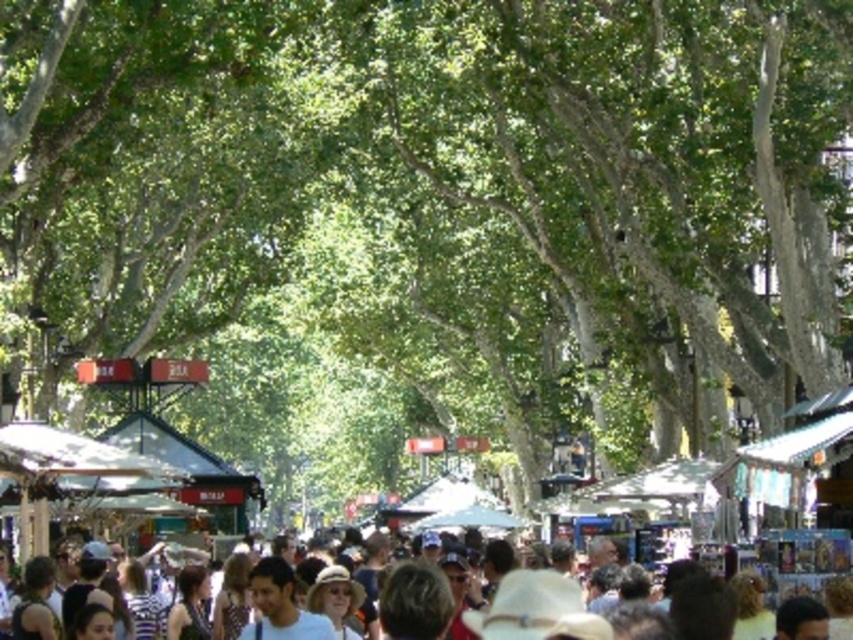
Does multicolored fabric crowd at center have a larger size compared to light brown hair at center?

Correct, multicolored fabric crowd at center is larger in size than light brown hair at center.

Identify the location of multicolored fabric crowd at center. (815, 547).

You are a GUI agent. You are given a task and a screenshot of the screen. Output one action in this format:
    pyautogui.click(x=<x>, y=<y>)
    Task: Click on the multicolored fabric crowd at center
    
    Given the screenshot: What is the action you would take?
    pyautogui.click(x=815, y=547)